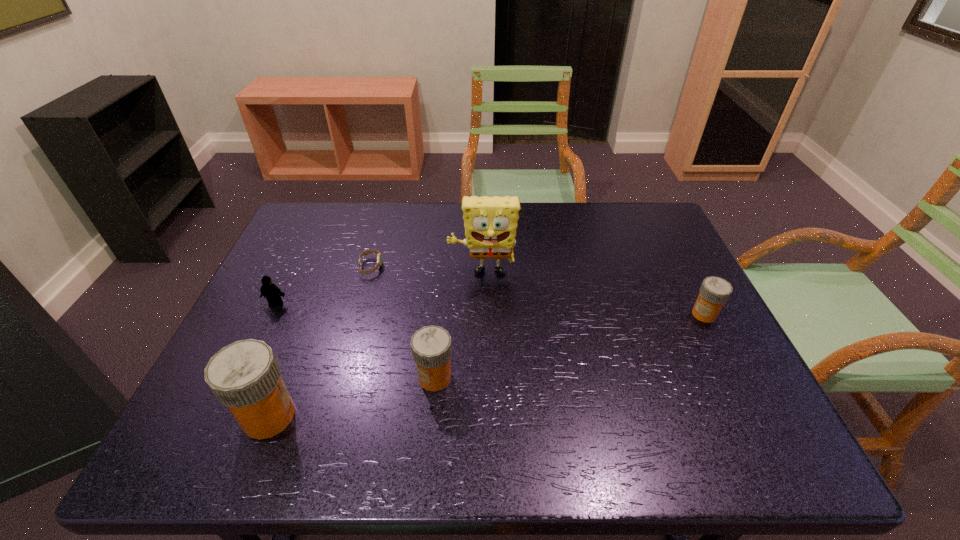
At what (x,y) coordinates should I click in order to perform the action: click on the fifth shortest object. Please return your answer as a coordinate pair (x, y). Looking at the image, I should click on (245, 376).

Where is `the tallest medicine`? This screenshot has width=960, height=540. the tallest medicine is located at coordinates (245, 376).

Locate an element on the screen. The width and height of the screenshot is (960, 540). the second tallest medicine is located at coordinates (431, 347).

Where is `the third tallest object`? Image resolution: width=960 pixels, height=540 pixels. the third tallest object is located at coordinates (431, 347).

Locate an element on the screen. This screenshot has width=960, height=540. the shortest medicine is located at coordinates (714, 292).

Where is `the rightmost object`? This screenshot has height=540, width=960. the rightmost object is located at coordinates (714, 292).

Locate an element on the screen. The width and height of the screenshot is (960, 540). sponge is located at coordinates (490, 223).

Where is `the fourth object from right to left`? the fourth object from right to left is located at coordinates (379, 258).

The height and width of the screenshot is (540, 960). I want to click on watch, so click(379, 258).

Identify the location of the leftmost object. (273, 294).